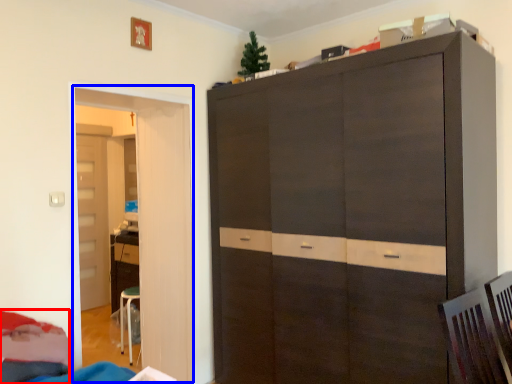
Question: Which of the following is the closest to the observer, bed (highlighted by a red box) or door (highlighted by a blue box)?

Choices:
 (A) bed
 (B) door

Answer: (A)